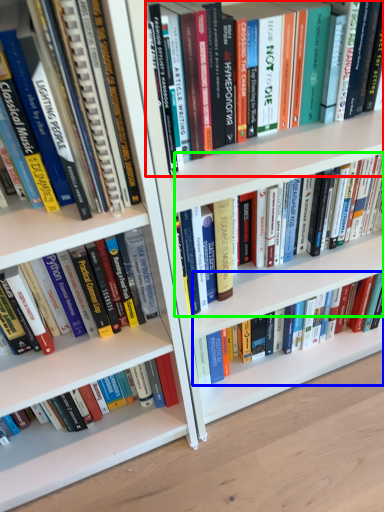
Question: Which is farther away from book (highlighted by a red box)? book (highlighted by a blue box) or book (highlighted by a green box)?

Choices:
 (A) book
 (B) book

Answer: (A)